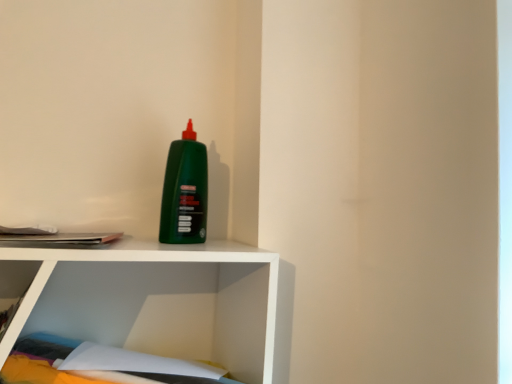
Locate an element on the screen. green matte bottle at center is located at coordinates (185, 191).

This screenshot has height=384, width=512. What do you see at coordinates (185, 191) in the screenshot?
I see `green matte bottle at center` at bounding box center [185, 191].

Identify the location of green matte bottle at center. The height and width of the screenshot is (384, 512). (185, 191).